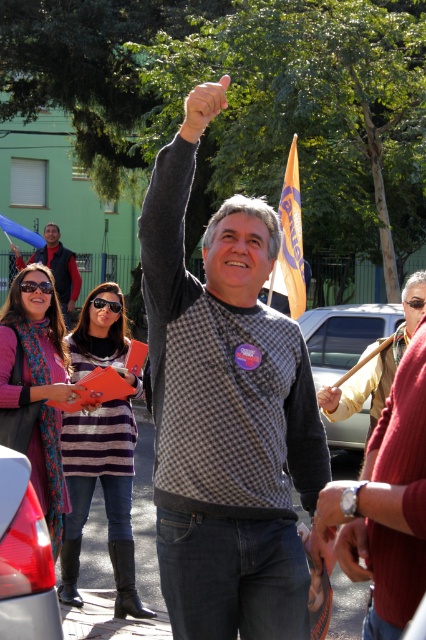
Question: Among these points, which one is farthest from the camera?

Choices:
 (A) (9, 225)
 (B) (77, 273)

Answer: (A)

Question: Among these points, which one is farthest from the camera?

Choices:
 (A) (354, 404)
 (B) (3, 225)
 (C) (278, 211)
 (D) (222, 445)

Answer: (B)

Question: Is checkered sweater at center closer to camera compared to leather jacket at center?

Choices:
 (A) yes
 (B) no

Answer: (A)

Question: Can you confirm if checkered sweater at center is positioned to the left of orange fabric flag at upper center?

Choices:
 (A) no
 (B) yes

Answer: (B)

Question: Does leather jacket at center have a larger size compared to matte black jacket at upper left?

Choices:
 (A) no
 (B) yes

Answer: (B)

Question: Which point is closer to the camera?

Choices:
 (A) blue fabric flag at upper left
 (B) matte black jacket at upper left
 (C) checkered sweater at center
 (D) orange fabric flag at upper center

Answer: (C)